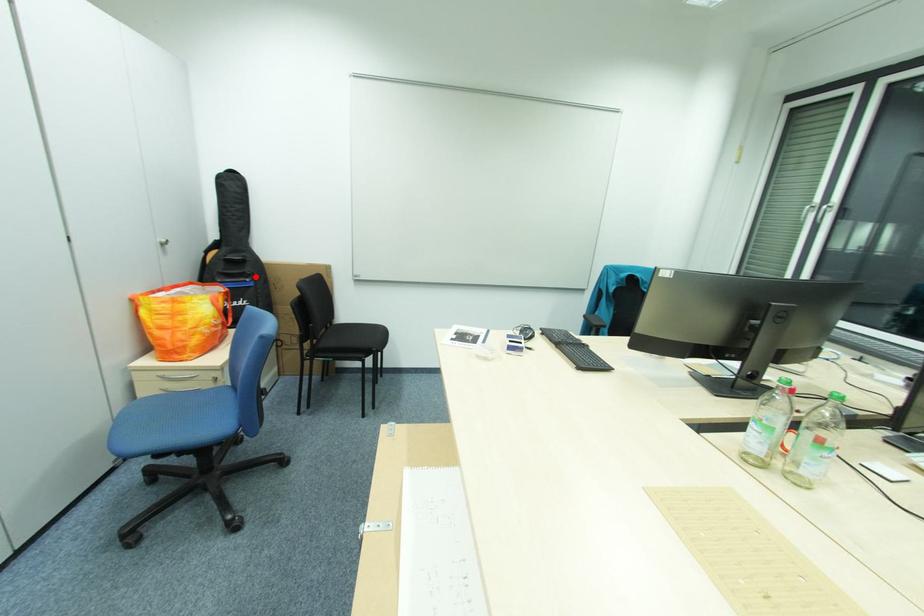
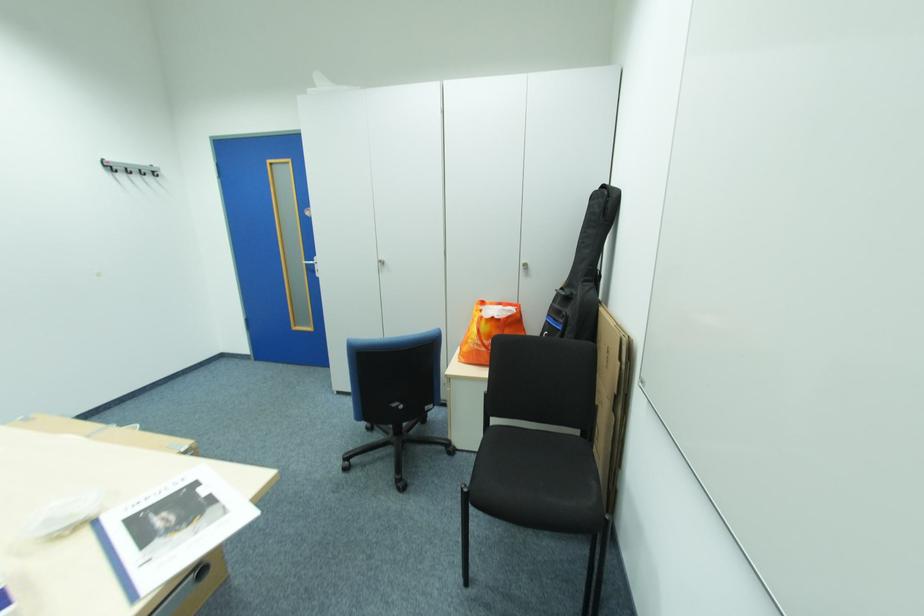
Locate, in the second image, the point that corresponds to the highlighted location in the first image.

(572, 318)